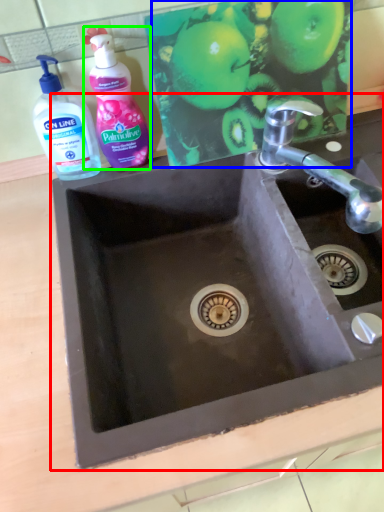
Question: Considering the real-world distances, which object is farthest from sink (highlighted by a red box)? apple (highlighted by a blue box) or cleaning product (highlighted by a green box)?

Choices:
 (A) apple
 (B) cleaning product

Answer: (B)